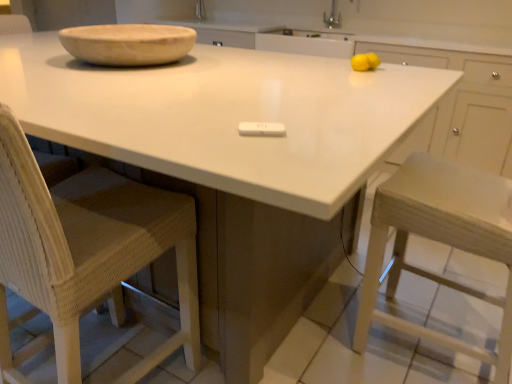
Question: Is wooden bowl at upper left a part of woven wood chair at left?

Choices:
 (A) no
 (B) yes

Answer: (A)

Question: Does woven wood chair at left have a greater width compared to wooden bowl at upper left?

Choices:
 (A) yes
 (B) no

Answer: (B)

Question: Is woven wood chair at left closer to the viewer compared to wooden bowl at upper left?

Choices:
 (A) no
 (B) yes

Answer: (B)

Question: Can you confirm if woven wood chair at left is shorter than wooden bowl at upper left?

Choices:
 (A) yes
 (B) no

Answer: (B)

Question: Considering the relative sizes of woven wood chair at left and wooden bowl at upper left in the image provided, is woven wood chair at left thinner than wooden bowl at upper left?

Choices:
 (A) no
 (B) yes

Answer: (B)

Question: Is woven wood chair at left behind wooden bowl at upper left?

Choices:
 (A) yes
 (B) no

Answer: (B)

Question: Is white glossy countertop at center positioned beyond the bounds of wooden bowl at upper left?

Choices:
 (A) no
 (B) yes

Answer: (B)

Question: From the image's perspective, is white glossy countertop at center below wooden bowl at upper left?

Choices:
 (A) no
 (B) yes

Answer: (B)

Question: Is white glossy countertop at center shorter than wooden bowl at upper left?

Choices:
 (A) no
 (B) yes

Answer: (A)

Question: Is white glossy countertop at center positioned before wooden bowl at upper left?

Choices:
 (A) yes
 (B) no

Answer: (A)

Question: Would you say white glossy countertop at center contains wooden bowl at upper left?

Choices:
 (A) yes
 (B) no

Answer: (B)

Question: Is white glossy countertop at center to the right of wooden bowl at upper left from the viewer's perspective?

Choices:
 (A) no
 (B) yes

Answer: (A)

Question: Are wooden bowl at upper left and woven wood chair at left making contact?

Choices:
 (A) no
 (B) yes

Answer: (A)